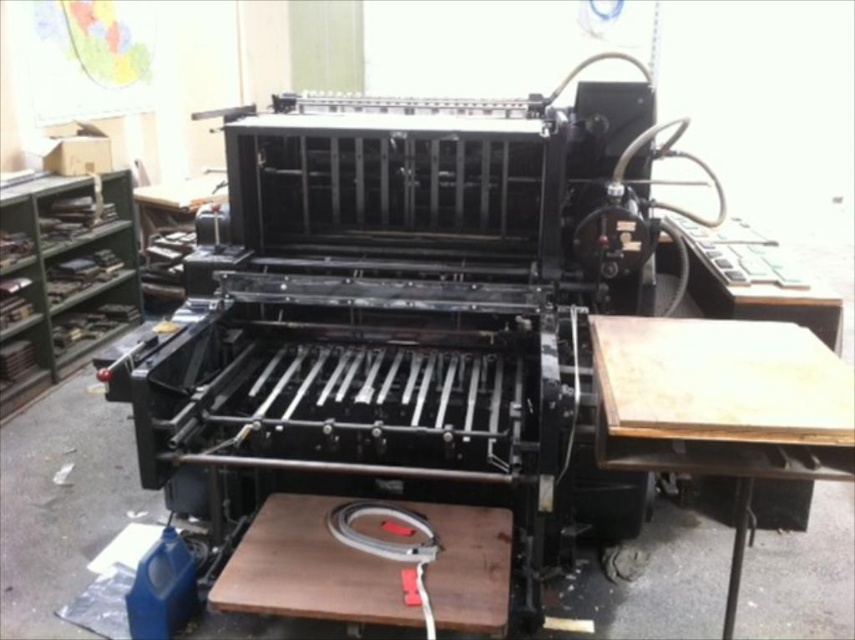
Question: Observing the image, what is the correct spatial positioning of wooden table at right in reference to brown wooden table at center?

Choices:
 (A) below
 (B) above

Answer: (B)

Question: Which point appears closest to the camera in this image?

Choices:
 (A) (370, 529)
 (B) (684, 435)

Answer: (B)

Question: Does wooden table at right appear on the right side of brown wooden table at center?

Choices:
 (A) no
 (B) yes

Answer: (B)

Question: Does wooden table at right appear on the right side of brown wooden table at center?

Choices:
 (A) no
 (B) yes

Answer: (B)

Question: Which object is farther from the camera taking this photo?

Choices:
 (A) wooden table at right
 (B) brown wooden table at center

Answer: (B)